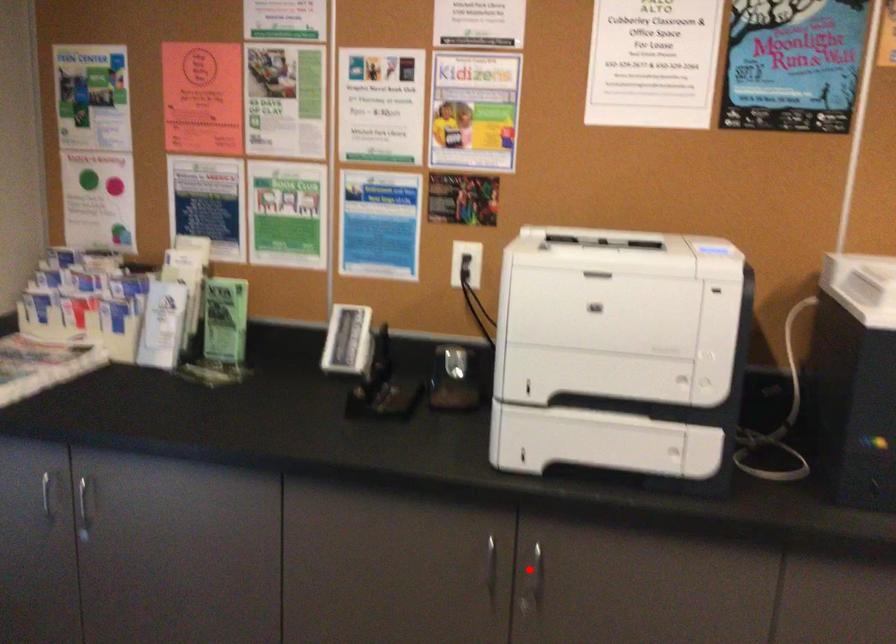
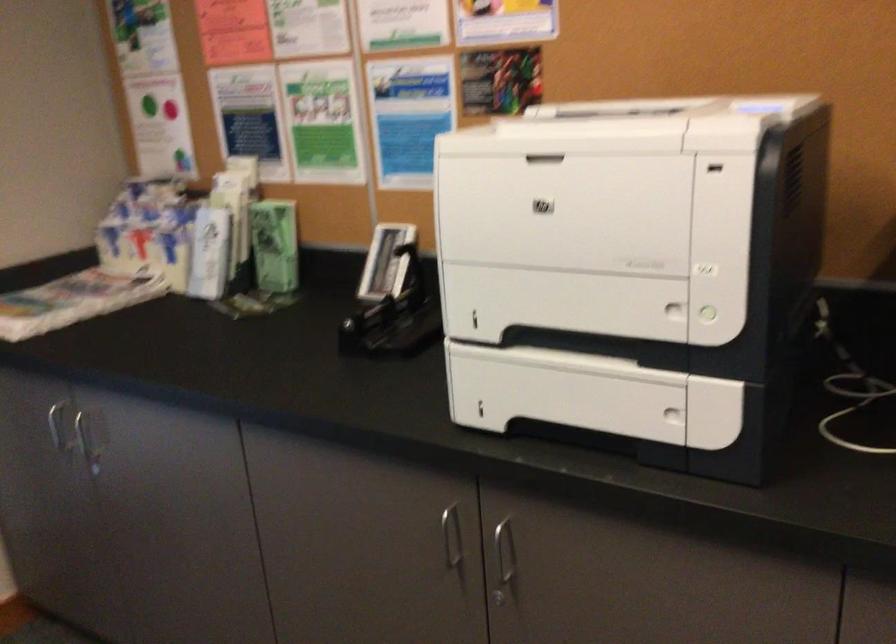
Question: I am providing you with two images of the same scene from different viewpoints. Given a red point in image1, look at the same physical point in image2. Is it:

Choices:
 (A) Closer to the viewpoint
 (B) Farther from the viewpoint

Answer: (A)